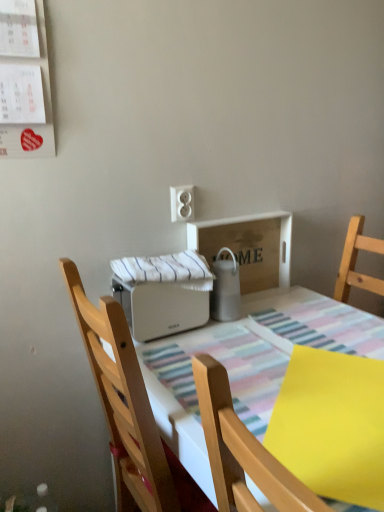
Locate an element on the screen. This screenshot has width=384, height=512. free point above yellow matte paper at lower right (from a real-world perspective) is located at coordinates (333, 418).